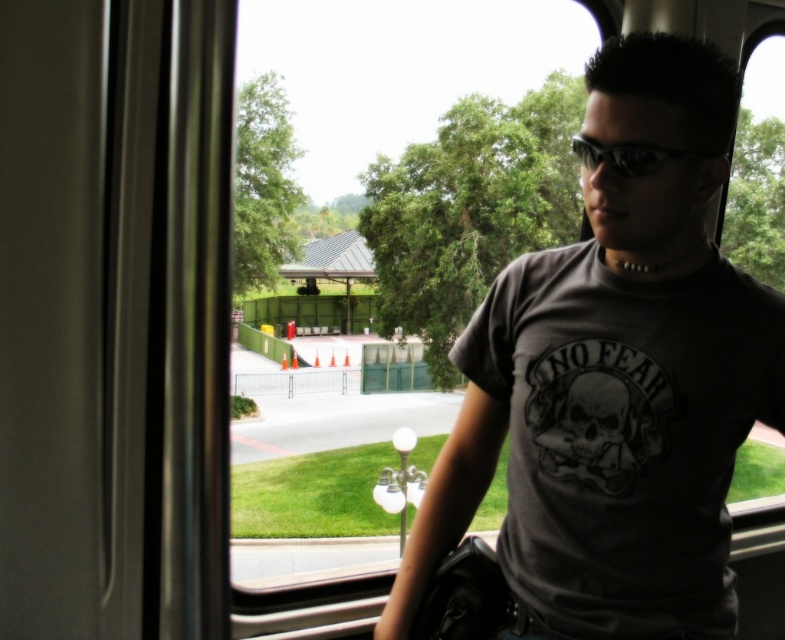
You are standing inside the train and looking out the window. You notice two points marked on the window. The first point is at coordinate point (641,628) and the second is at point (575,152). Which point is closer to you?

Point (641,628) is closer to you because it is further to the viewer than point (575,152).